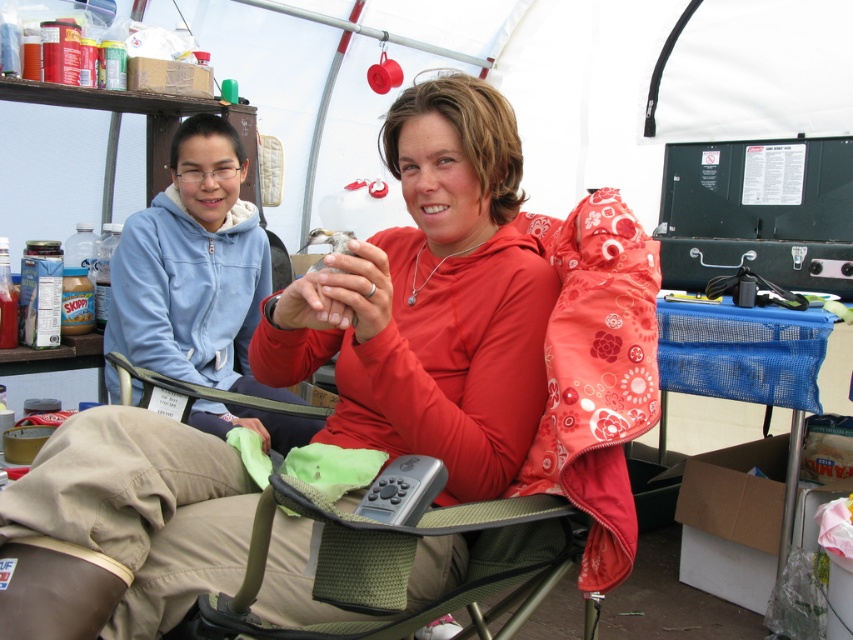
From the picture: Who is lower down, matte red shirt at center or khaki fabric pants at lower center?

khaki fabric pants at lower center

Can you confirm if matte red shirt at center is positioned below khaki fabric pants at lower center?

Actually, matte red shirt at center is above khaki fabric pants at lower center.

Where is `matte red shirt at center`? Image resolution: width=853 pixels, height=640 pixels. matte red shirt at center is located at coordinates (430, 301).